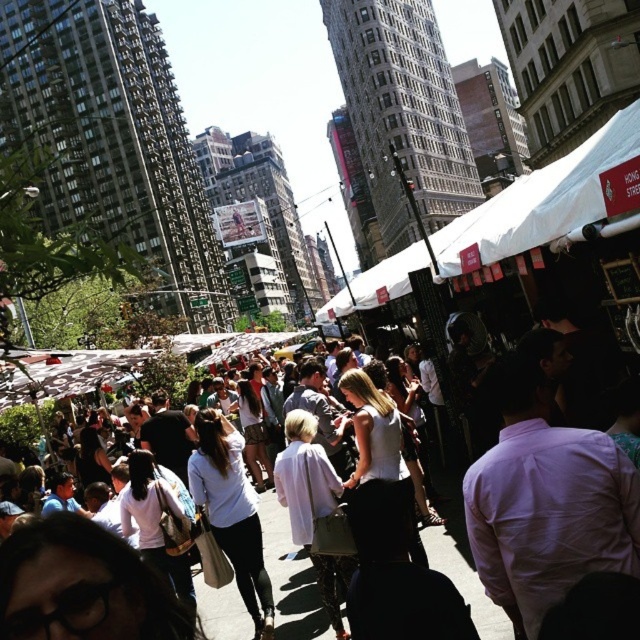
Is white fabric canopy at upper center positioned in front of white cotton crowd at center?

Yes, it is in front of white cotton crowd at center.

The height and width of the screenshot is (640, 640). I want to click on white fabric canopy at upper center, so click(x=506, y=220).